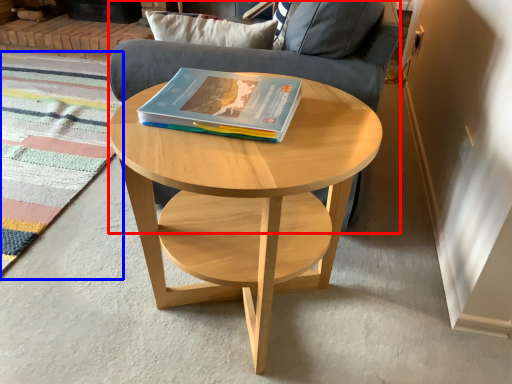
Question: Which object is closer to the camera taking this photo, armchair (highlighted by a red box) or mat (highlighted by a blue box)?

Choices:
 (A) armchair
 (B) mat

Answer: (A)